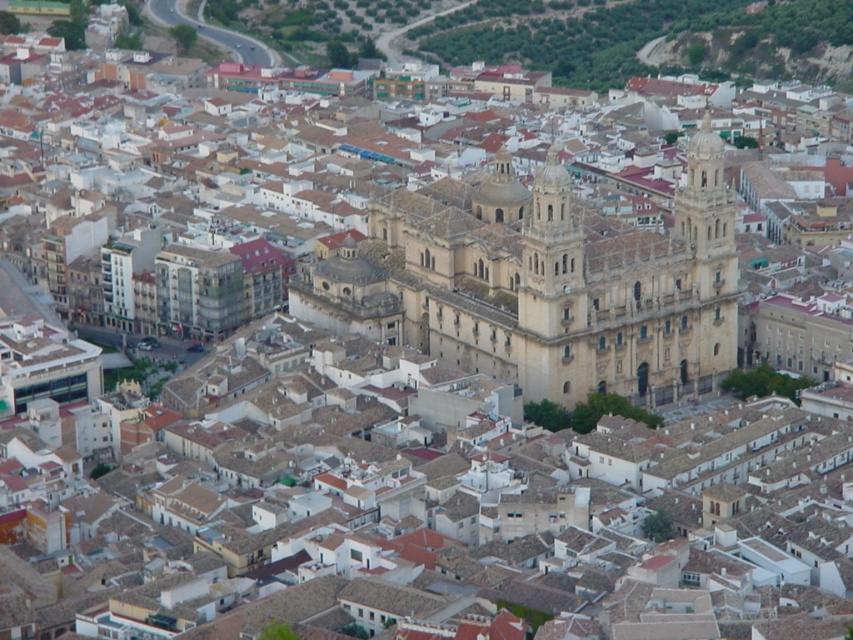
Measure the distance from light beige stone tower at center to beige stone tower at center.

The distance of light beige stone tower at center from beige stone tower at center is 12.73 meters.

Can you confirm if light beige stone tower at center is wider than beige stone tower at center?

In fact, light beige stone tower at center might be narrower than beige stone tower at center.

Is point (560, 340) in front of point (734, 307)?

Yes, it is in front of point (734, 307).

Locate an element on the screen. This screenshot has width=853, height=640. light beige stone tower at center is located at coordinates (553, 294).